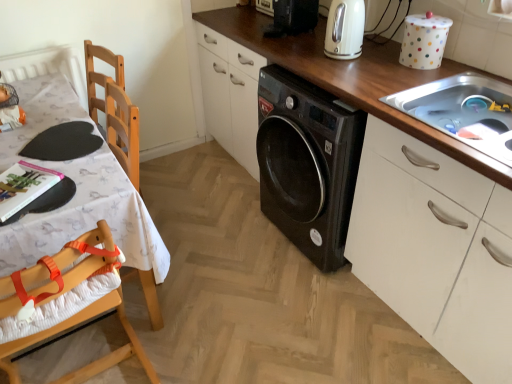
Identify the location of vacant area in front of black plastic washing machine at upper center, which ranks as the 2th appliance in front-to-back order. (298, 49).